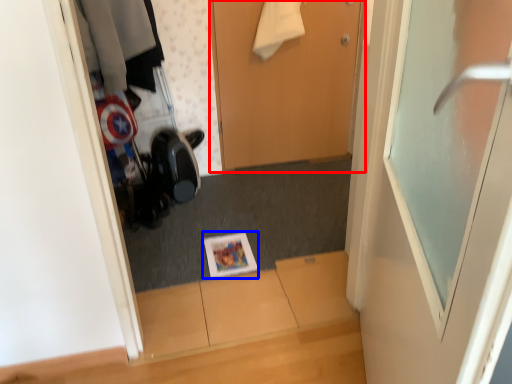
Question: Which point is further to the camera, door (highlighted by a red box) or magazine (highlighted by a blue box)?

Choices:
 (A) door
 (B) magazine

Answer: (A)